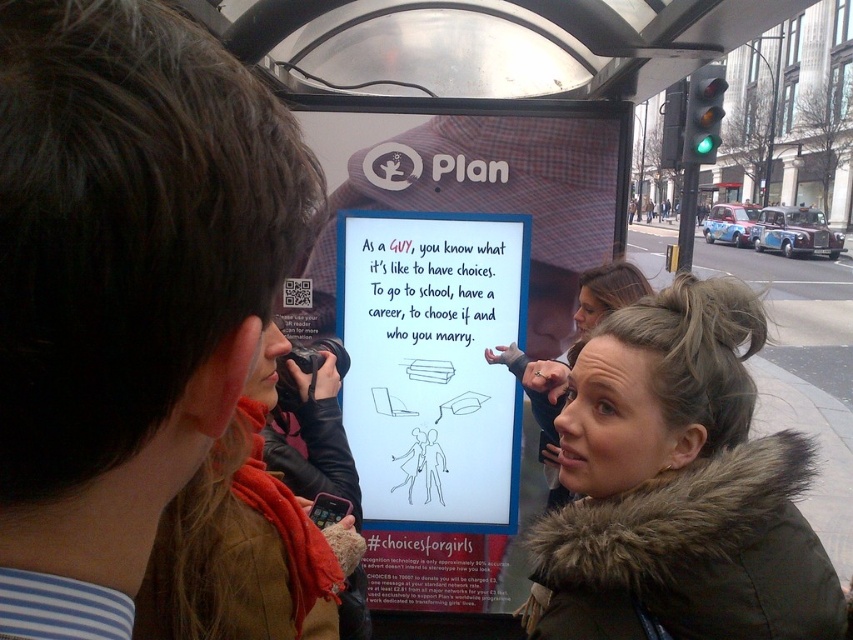
Question: Which point is farther from the camera taking this photo?

Choices:
 (A) click(277, 248)
 (B) click(241, 637)

Answer: (B)

Question: Does dark brown hair at upper left appear under brown fur coat at center?

Choices:
 (A) no
 (B) yes

Answer: (A)

Question: Considering the relative positions of brown fur coat at center and brown fur coat at lower right in the image provided, where is brown fur coat at center located with respect to brown fur coat at lower right?

Choices:
 (A) above
 (B) below

Answer: (A)

Question: Among these points, which one is farthest from the camera?

Choices:
 (A) (544, 424)
 (B) (16, 582)

Answer: (A)

Question: Can you confirm if dark brown hair at upper left is positioned below red scarf at center?

Choices:
 (A) no
 (B) yes

Answer: (A)

Question: Which object appears closest to the camera in this image?

Choices:
 (A) brown fur coat at center
 (B) red scarf at center
 (C) dark brown hair at upper left

Answer: (C)